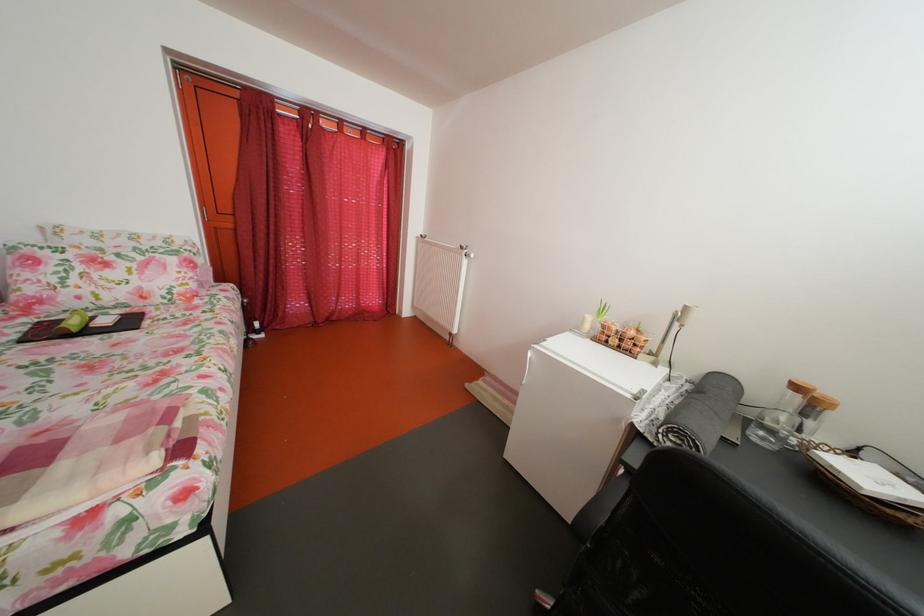
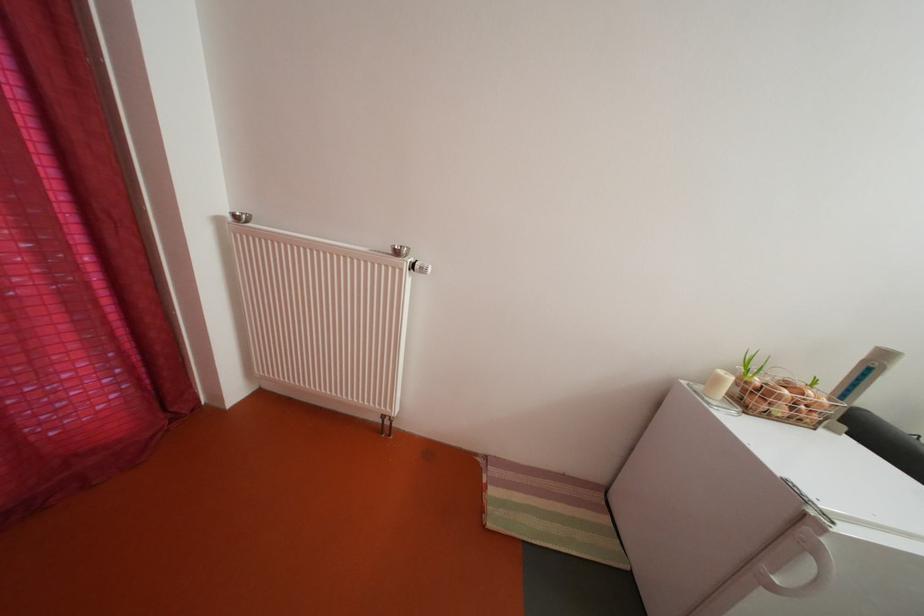
Find the pixel in the second image that matches point 594,325 in the first image.

(728, 386)